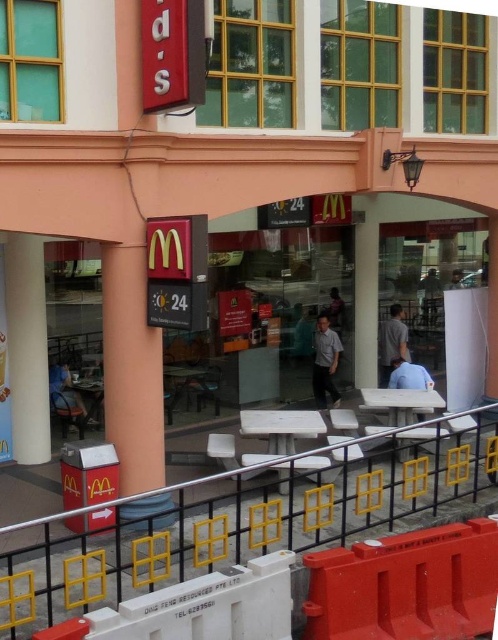
Question: Is the position of metallic yellow fence at lower center less distant than that of light brown leather jacket at center?

Choices:
 (A) yes
 (B) no

Answer: (A)

Question: Observing the image, what is the correct spatial positioning of blue fabric shirt at lower center in reference to light brown leather jacket at center?

Choices:
 (A) above
 (B) below

Answer: (B)

Question: Which object is closer to the camera taking this photo?

Choices:
 (A) light brown leather jacket at center
 (B) orange matte pillar at center
 (C) metallic yellow fence at lower center

Answer: (C)

Question: Which point is farther to the camera?

Choices:
 (A) blue fabric shirt at lower center
 (B) orange matte pillar at center
 (C) gray fabric shirt at center

Answer: (C)

Question: Estimate the real-world distances between objects in this image. Which object is closer to the dark gray shirt at center?

Choices:
 (A) light brown leather jacket at center
 (B) matte black chair at lower left

Answer: (B)

Question: Is metallic yellow fence at lower center bigger than dark gray shirt at center?

Choices:
 (A) no
 (B) yes

Answer: (B)